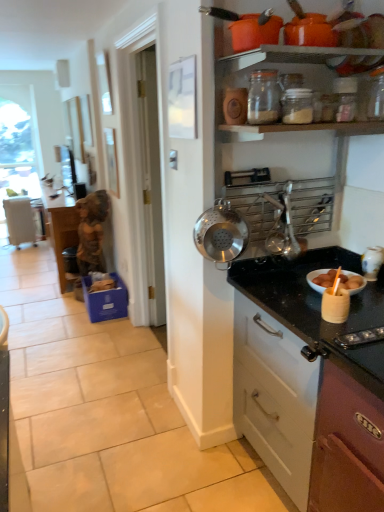
Question: From the image's perspective, is clear glass jar at upper center, arranged as the 1th kitchen appliance when viewed from the top, located above metallic silver utensil rack at upper center?

Choices:
 (A) no
 (B) yes

Answer: (B)

Question: Is metallic silver utensil rack at upper center inside clear glass jar at upper center, arranged as the 1th kitchen appliance when viewed from the top?

Choices:
 (A) no
 (B) yes

Answer: (A)

Question: Does clear glass jar at upper center, arranged as the 1th kitchen appliance when viewed from the top, have a larger size compared to metallic silver utensil rack at upper center?

Choices:
 (A) no
 (B) yes

Answer: (A)

Question: Can you confirm if clear glass jar at upper center, arranged as the 1th kitchen appliance when viewed from the top, is smaller than metallic silver utensil rack at upper center?

Choices:
 (A) no
 (B) yes

Answer: (B)

Question: Does clear glass jar at upper center, arranged as the 1th kitchen appliance when viewed from the top, lie behind metallic silver utensil rack at upper center?

Choices:
 (A) yes
 (B) no

Answer: (A)

Question: From a real-world perspective, is metallic silver utensil rack at upper center physically located above or below clear glass jar at upper center, which is the third kitchen appliance in bottom-to-top order?

Choices:
 (A) above
 (B) below

Answer: (B)

Question: In the image, is metallic silver utensil rack at upper center positioned in front of or behind clear glass jar at upper center, which is the third kitchen appliance in bottom-to-top order?

Choices:
 (A) behind
 (B) front

Answer: (B)

Question: Is metallic silver utensil rack at upper center bigger or smaller than clear glass jar at upper center, which is the third kitchen appliance in bottom-to-top order?

Choices:
 (A) big
 (B) small

Answer: (A)

Question: Visually, is metallic silver utensil rack at upper center positioned to the left or to the right of clear glass jar at upper center, which is the third kitchen appliance in bottom-to-top order?

Choices:
 (A) left
 (B) right

Answer: (B)

Question: From a real-world perspective, relative to metallic silver utensil rack at upper center, is black granite countertop at right vertically above or below?

Choices:
 (A) below
 (B) above

Answer: (A)

Question: Is point (264, 429) closer or farther from the camera than point (279, 455)?

Choices:
 (A) farther
 (B) closer

Answer: (A)

Question: From their relative heights in the image, would you say black granite countertop at right is taller or shorter than metallic silver utensil rack at upper center?

Choices:
 (A) short
 (B) tall

Answer: (A)

Question: From the image's perspective, is black granite countertop at right located above or below metallic silver utensil rack at upper center?

Choices:
 (A) below
 (B) above

Answer: (A)

Question: Does point (235, 227) appear closer or farther from the camera than point (347, 349)?

Choices:
 (A) farther
 (B) closer

Answer: (A)

Question: In terms of height, does stainless steel colander at upper right, arranged as the 3th kitchen appliance when viewed from the top, look taller or shorter compared to metallic silver utensil rack at upper center?

Choices:
 (A) short
 (B) tall

Answer: (A)